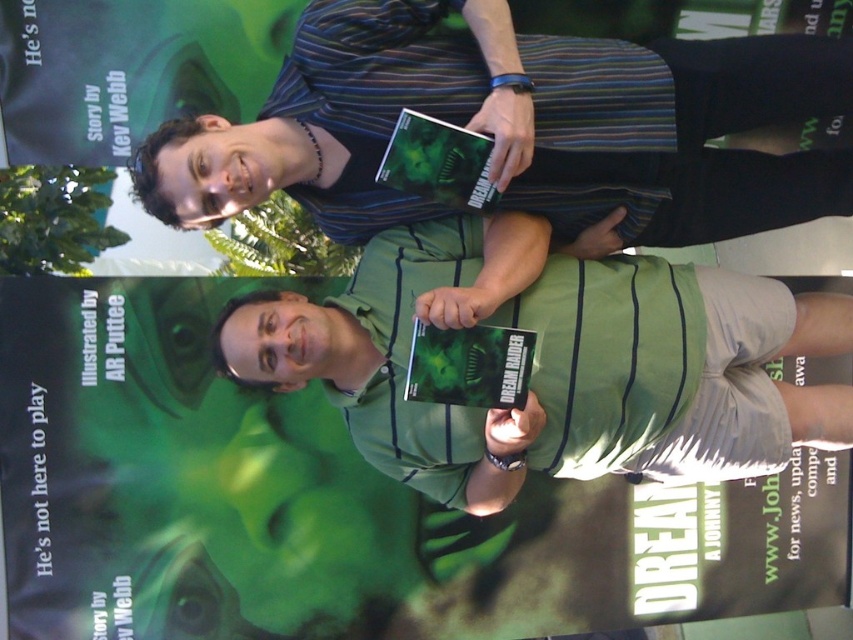
Is green striped shirt at upper center wider than green striped shirt at center?

Yes, green striped shirt at upper center is wider than green striped shirt at center.

Can you confirm if green striped shirt at upper center is shorter than green striped shirt at center?

Correct, green striped shirt at upper center is not as tall as green striped shirt at center.

Who is more distant from viewer, (465,60) or (740,291)?

The point (740,291) is more distant.

Identify the location of green striped shirt at upper center. The width and height of the screenshot is (853, 640). (517, 125).